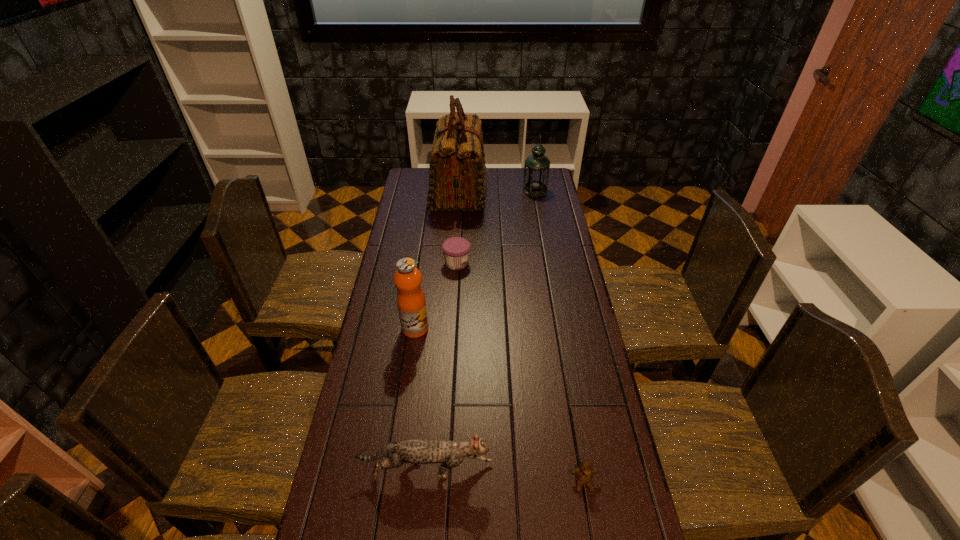
Where is `the tallest object`? the tallest object is located at coordinates (457, 181).

In order to click on oil lamp in this screenshot , I will do coord(536,172).

In order to click on fruit juice in this screenshot , I will do `click(411, 302)`.

Locate an element on the screen. The height and width of the screenshot is (540, 960). the third shortest object is located at coordinates (450, 454).

What are the coordinates of `the third farthest object` in the screenshot? It's located at (456, 250).

Identify the location of teddy bear. (584, 473).

Find the location of a particular element. Image resolution: width=960 pixels, height=540 pixels. free location located 0.310m on the open handle side of the shopping bag is located at coordinates (550, 192).

Identify the location of blank space located on the front of the oil lamp. (539, 210).

At what (x,y) coordinates should I click in order to perform the action: click on free space located 0.380m on the front of the third nearest object. Please return your answer as a coordinate pair (x, y). The height and width of the screenshot is (540, 960). Looking at the image, I should click on (398, 444).

Locate an element on the screen. Image resolution: width=960 pixels, height=540 pixels. blank space located on the face of the cat is located at coordinates (545, 470).